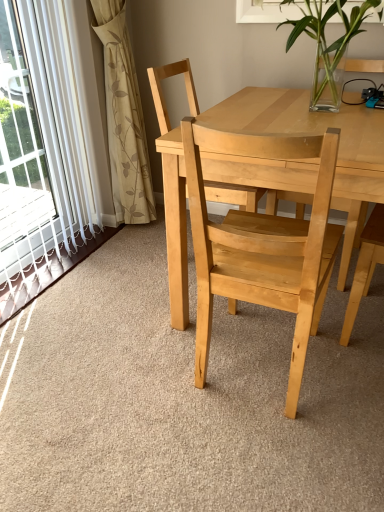
Locate an element on the screen. free space on the front side of natural wood chair at center, placed as the first chair when sorted from front to back is located at coordinates (267, 455).